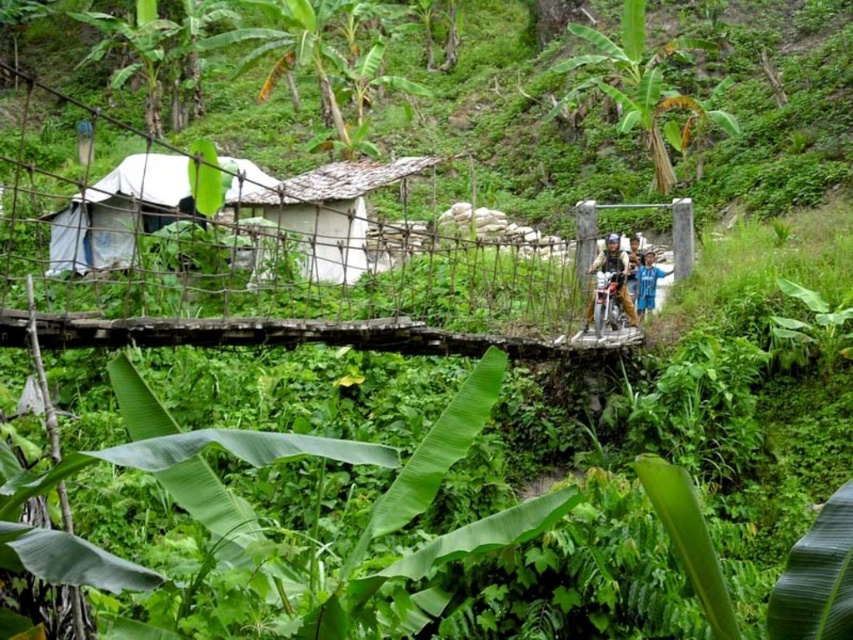
Question: Can you confirm if rope bridge at center is positioned above blue striped shirt at center?

Choices:
 (A) yes
 (B) no

Answer: (A)

Question: Which object is farther from the camera taking this photo?

Choices:
 (A) metallic helmet at center
 (B) blue fabric shirt at center

Answer: (B)

Question: Does rope bridge at center have a greater width compared to white fabric tent at left?

Choices:
 (A) no
 (B) yes

Answer: (B)

Question: Which point appears farthest from the camera in this image?

Choices:
 (A) (628, 300)
 (B) (329, 184)

Answer: (B)

Question: From the image, what is the correct spatial relationship of white fabric tent at left in relation to blue striped shirt at center?

Choices:
 (A) above
 (B) below

Answer: (A)

Question: Which point appears closest to the camera in this image?

Choices:
 (A) (550, 157)
 (B) (631, 296)
 (C) (643, 257)

Answer: (B)